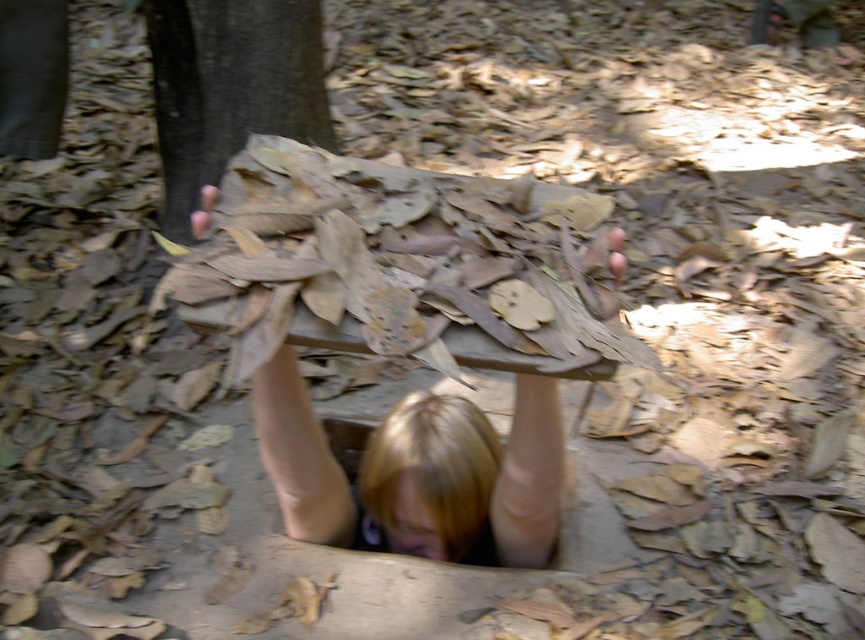
You are a hiker who has lost your way in a forest. You see a brown rough tree trunk at upper left and a blonde hair at center. Which object is located to the left of the other?

The brown rough tree trunk at upper left is positioned on the left side of blonde hair at center.